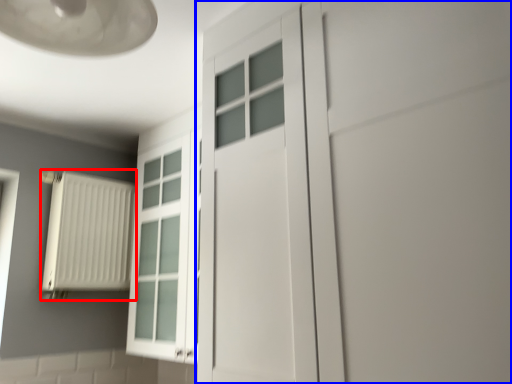
Question: Which object appears farthest to the camera in this image, radiator (highlighted by a red box) or door (highlighted by a blue box)?

Choices:
 (A) radiator
 (B) door

Answer: (A)